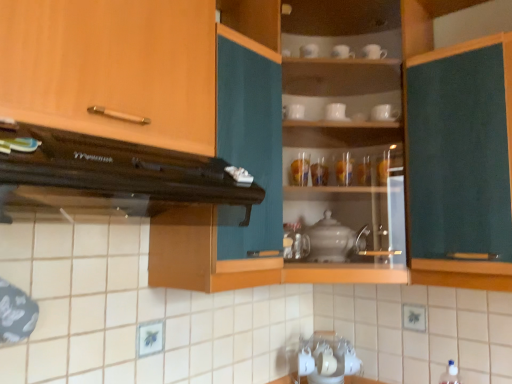
Question: Should I look upward or downward to see white ceramic cup at upper center, the sixth tableware positioned from the left?

Choices:
 (A) down
 (B) up

Answer: (B)

Question: From a real-world perspective, does white glossy cup at upper center, which is the sixth tableware from right to left, stand above translucent glass vase at upper center, the 5th tableware viewed from the left?

Choices:
 (A) no
 (B) yes

Answer: (B)

Question: Does white glossy cup at upper center, which is the sixth tableware from right to left, lie in front of translucent glass vase at upper center, which is the second tableware from right to left?

Choices:
 (A) yes
 (B) no

Answer: (A)

Question: Is white glossy cup at upper center, which is the first tableware from left to right, facing towards translucent glass vase at upper center, the 5th tableware viewed from the left?

Choices:
 (A) yes
 (B) no

Answer: (B)

Question: Is white glossy cup at upper center, which is the first tableware from left to right, at the left side of translucent glass vase at upper center, the 5th tableware viewed from the left?

Choices:
 (A) no
 (B) yes

Answer: (B)

Question: Is white glossy cup at upper center, which is the sixth tableware from right to left, to the right of translucent glass vase at upper center, the 5th tableware viewed from the left, from the viewer's perspective?

Choices:
 (A) yes
 (B) no

Answer: (B)

Question: Is white ceramic cup at upper center, the sixth tableware positioned from the left, at the left side of translucent glass vase at center, the 2th tableware positioned from the left?

Choices:
 (A) no
 (B) yes

Answer: (A)

Question: Is white ceramic cup at upper center, marked as the 1th tableware in a right-to-left arrangement, shorter than translucent glass vase at center, the 2th tableware positioned from the left?

Choices:
 (A) yes
 (B) no

Answer: (A)

Question: Is white ceramic cup at upper center, marked as the 1th tableware in a right-to-left arrangement, not near translucent glass vase at center, the 2th tableware positioned from the left?

Choices:
 (A) no
 (B) yes

Answer: (A)

Question: Is white ceramic cup at upper center, the sixth tableware positioned from the left, taller than translucent glass vase at center, the 2th tableware positioned from the left?

Choices:
 (A) no
 (B) yes

Answer: (A)

Question: From a real-world perspective, does white ceramic cup at upper center, the sixth tableware positioned from the left, stand above translucent glass vase at center, the 2th tableware positioned from the left?

Choices:
 (A) no
 (B) yes

Answer: (B)

Question: Is white ceramic cup at upper center, marked as the 1th tableware in a right-to-left arrangement, facing away from translucent glass vase at center, the 2th tableware positioned from the left?

Choices:
 (A) no
 (B) yes

Answer: (A)

Question: Is wooden cabinet handle at upper left, arranged as the first cabinetry when viewed from the left, next to satin silver teapot at center and touching it?

Choices:
 (A) no
 (B) yes

Answer: (A)